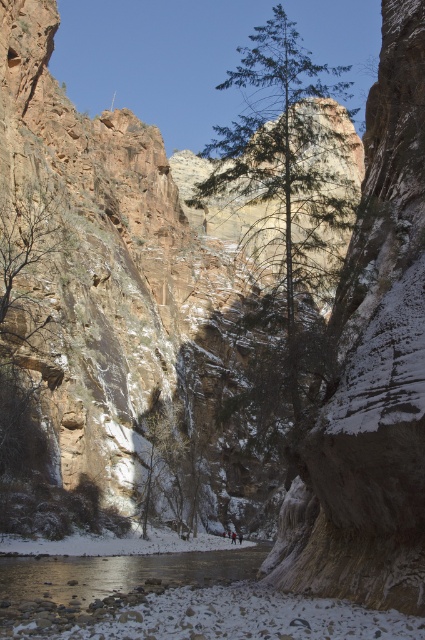
You are standing at the edge of the canyon and notice the clear water at lower center and the red jacket at center. Which object is higher in elevation?

The clear water at lower center is much taller as red jacket at center, meaning it is higher in elevation than the red jacket at center.

You are a hiker planning to cross the clear water at lower center to reach the green textured tree at center. Given that your backpack weighs 30 pounds, can you safely make the crossing?

The distance between the green textured tree at center and the clear water at lower center is 233.05 feet. Since the backpack weighs 30 pounds, the hiker can safely cross the clear water at lower center to reach the green textured tree at center as the distance does not affect the backpack weight capacity.

In the scene shown: You are hiking in the canyon and want to cross the stream. You see a green textured tree at center and clear water at lower center. Which object is closer to you, the hiker?

A: The green textured tree at center is closer to you than the clear water at lower center because it is further to the viewer.